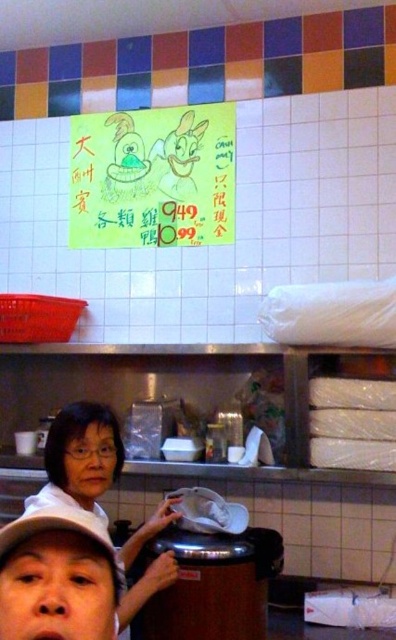
Which is more to the right, green paper sign at upper center or matte white shirt at center?

From the viewer's perspective, green paper sign at upper center appears more on the right side.

Who is shorter, green paper sign at upper center or matte white shirt at center?

With less height is green paper sign at upper center.

Where is `green paper sign at upper center`? Image resolution: width=396 pixels, height=640 pixels. green paper sign at upper center is located at coordinates coord(152,177).

Identify the location of green paper sign at upper center. This screenshot has height=640, width=396. (152, 177).